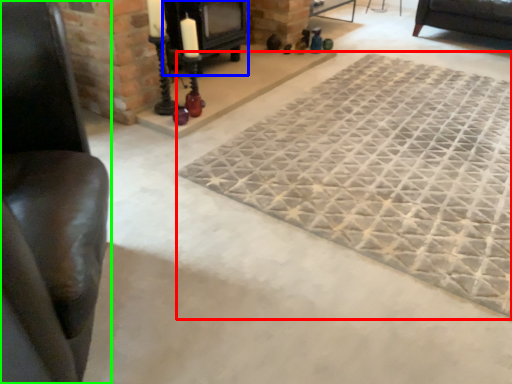
Question: Based on their relative distances, which object is farther from mat (highlighted by a red box)? Choose from fireplace (highlighted by a blue box) and furniture (highlighted by a green box).

Choices:
 (A) fireplace
 (B) furniture

Answer: (B)